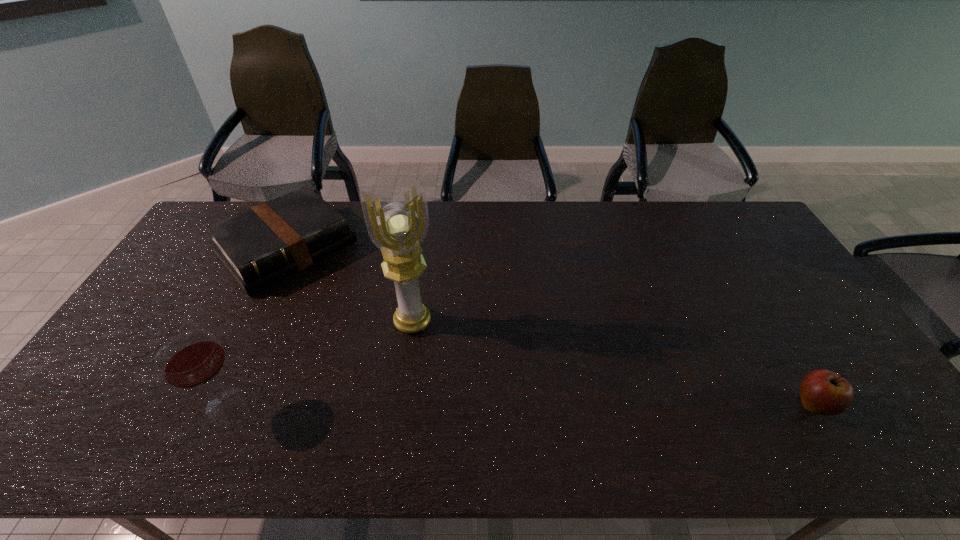
The image size is (960, 540). In order to click on free space on the desktop that is between the second tallest object and the rightmost object and is positioned on the front-facing side of the third object from left to right in this screenshot , I will do coord(441,405).

Locate an element on the screen. free space on the desktop that is between the third shortest object and the second shortest object and is positioned on the spine side of the hardback book is located at coordinates (441, 405).